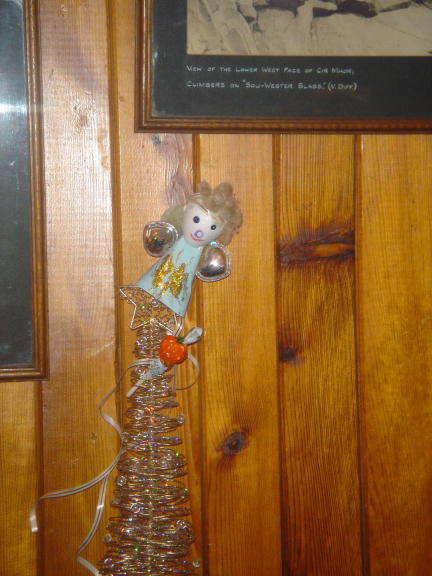
The height and width of the screenshot is (576, 432). I want to click on christmas decoration, so click(x=153, y=442), click(x=177, y=272), click(x=170, y=346).